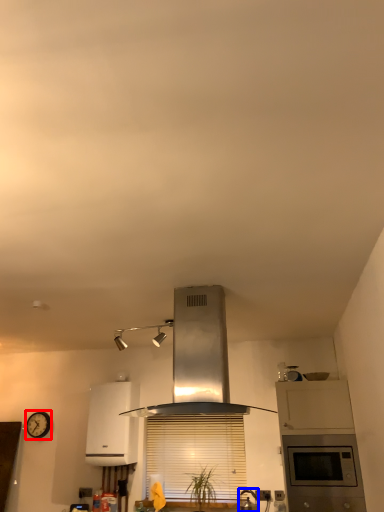
Question: Which object appears closest to the camera in this image, clock (highlighted by a red box) or kitchen appliance (highlighted by a blue box)?

Choices:
 (A) clock
 (B) kitchen appliance

Answer: (B)